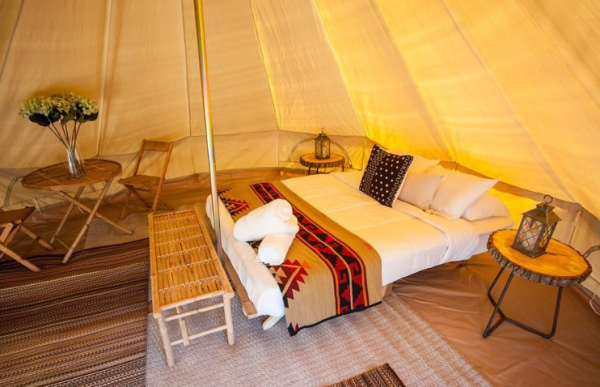
Find the location of a particular element. This screenshot has width=600, height=387. tables is located at coordinates (333, 160), (107, 172), (506, 257), (182, 287).